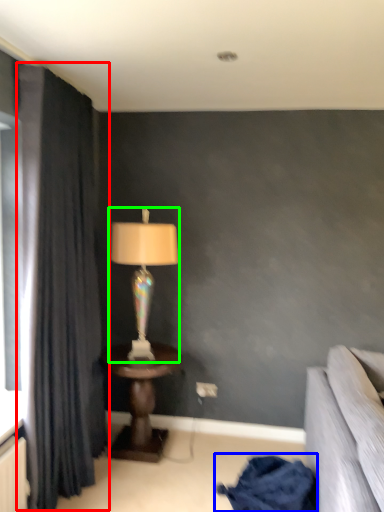
Question: Which object is positioned farthest from curtain (highlighted by a red box)? Select from blanket (highlighted by a blue box) and lamp (highlighted by a green box).

Choices:
 (A) blanket
 (B) lamp

Answer: (A)